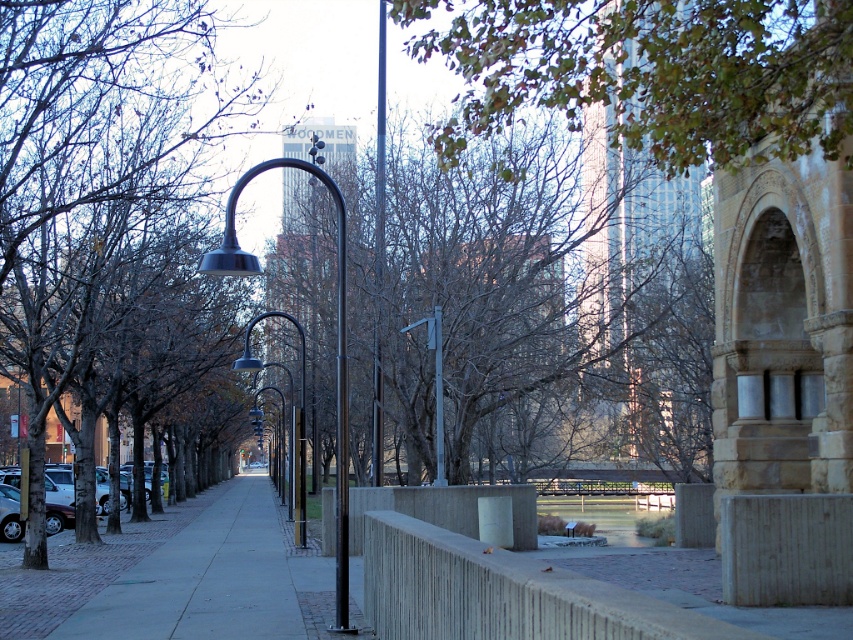
Who is lower down, gray concrete sidewalk at center or silver metallic street light at center?

gray concrete sidewalk at center is lower down.

Who is higher up, gray concrete sidewalk at center or silver metallic street light at center?

Positioned higher is silver metallic street light at center.

In order to click on gray concrete sidewalk at center in this screenshot , I will do `click(202, 579)`.

Is brown leafless tree at left bigger than smooth metal pole at center?

Correct, brown leafless tree at left is larger in size than smooth metal pole at center.

Is brown leafless tree at left to the right of smooth metal pole at center from the viewer's perspective?

In fact, brown leafless tree at left is to the left of smooth metal pole at center.

At what (x,y) coordinates should I click in order to perform the action: click on brown leafless tree at left. Please return your answer as a coordinate pair (x, y). The width and height of the screenshot is (853, 640). Looking at the image, I should click on (93, 168).

Is polished black street light at center above silver metallic street light at center?

Yes, polished black street light at center is above silver metallic street light at center.

Between polished black street light at center and silver metallic street light at center, which one is positioned lower?

silver metallic street light at center

Where is `polished black street light at center`? This screenshot has height=640, width=853. polished black street light at center is located at coordinates coord(337,348).